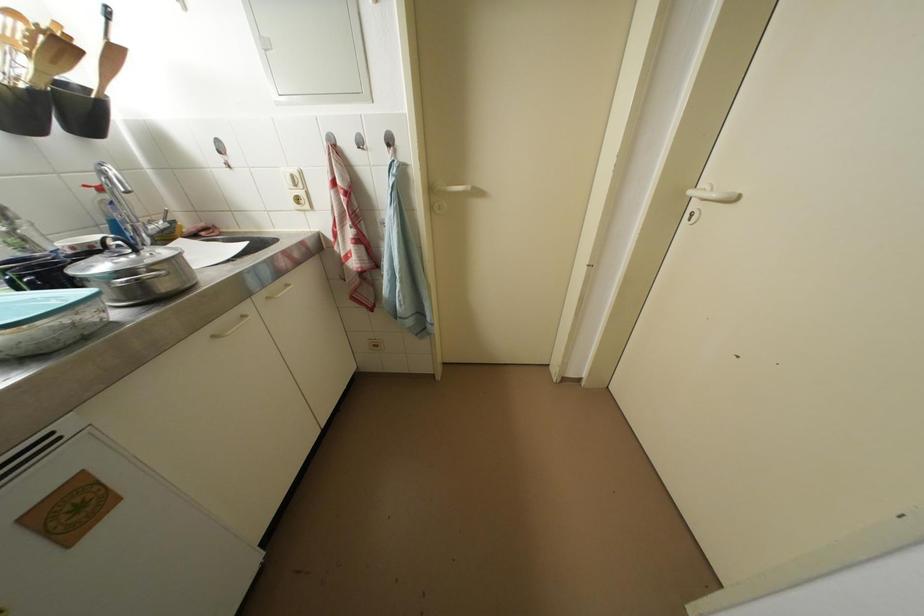
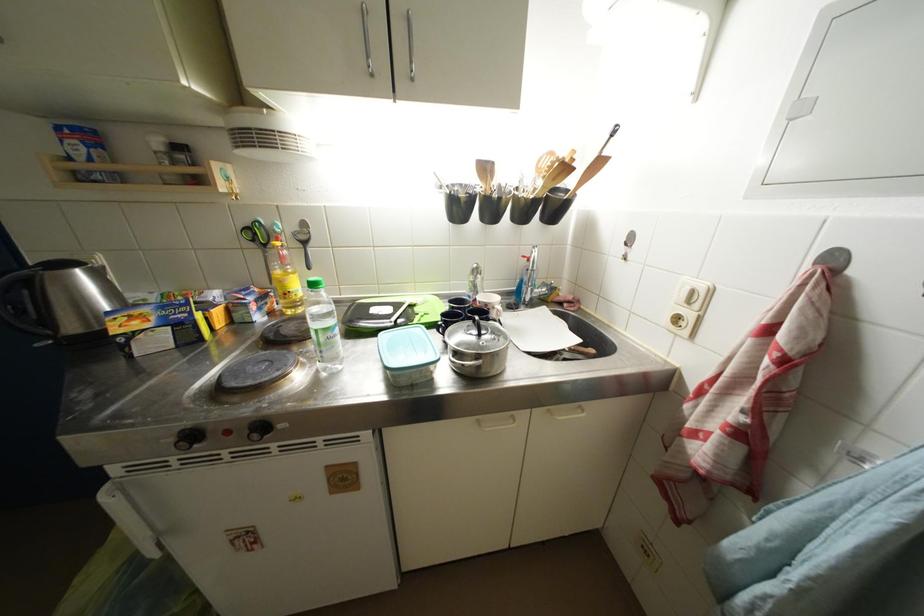
In the second image, find the point that corresponds to the point at 31,244 in the first image.

(481, 291)